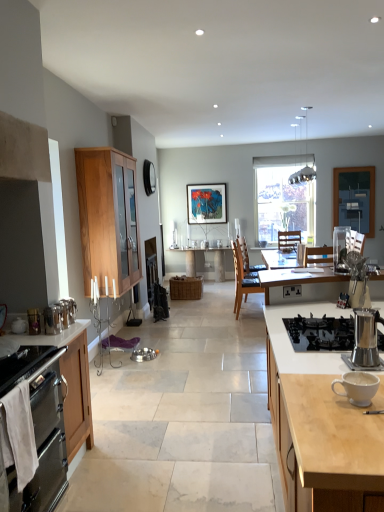
You are a GUI agent. You are given a task and a screenshot of the screen. Output one action in this format:
    pyautogui.click(x=<x>, y=<y>)
    Task: Click on the vacant space to the left of brown leather chair at center
    
    Given the screenshot: What is the action you would take?
    (220, 318)